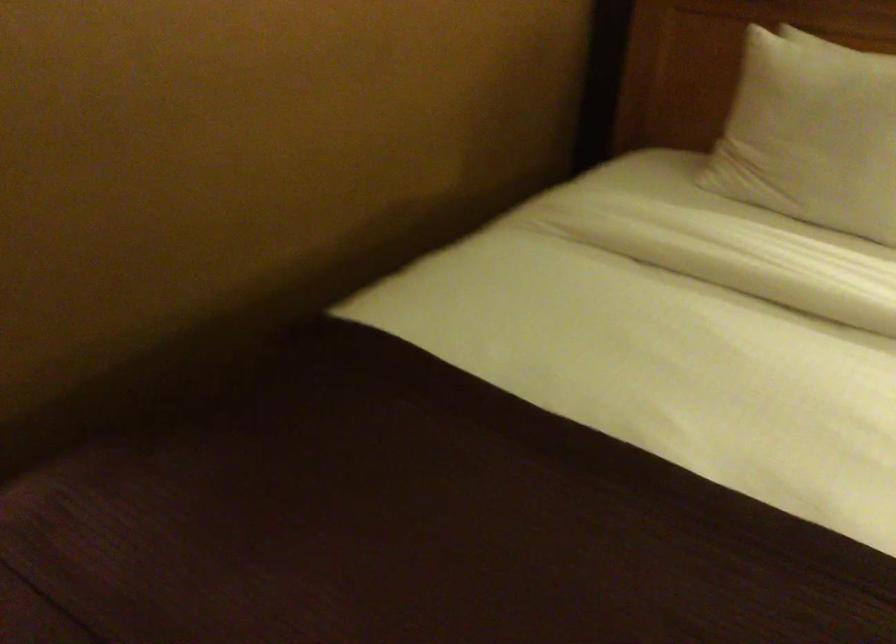
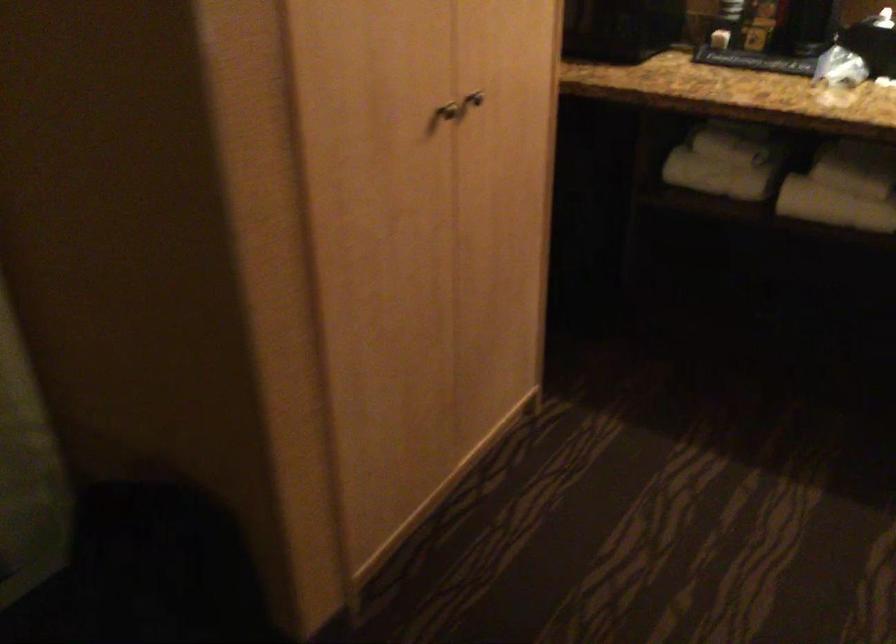
How did the camera likely rotate?

The camera rotated toward left-down.